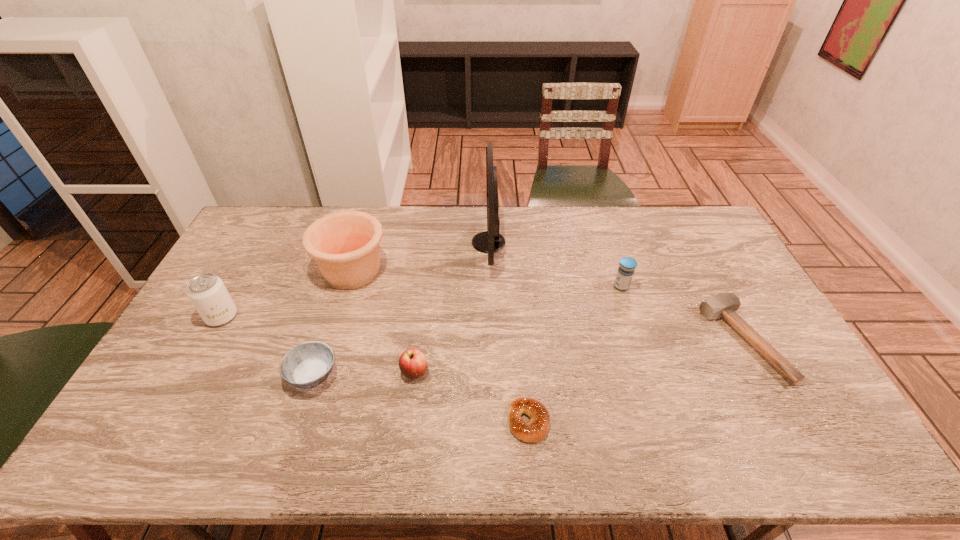
The image size is (960, 540). I want to click on unoccupied position between the soda can and the pottery, so click(287, 294).

You are a GUI agent. You are given a task and a screenshot of the screen. Output one action in this format:
    pyautogui.click(x=<x>, y=<y>)
    Task: Click on the empty space that is in between the third shortest object and the pottery
    The height and width of the screenshot is (540, 960).
    Given the screenshot: What is the action you would take?
    pyautogui.click(x=333, y=323)

Where is `vacant area that lies between the pottery and the third shortest object`? This screenshot has width=960, height=540. vacant area that lies between the pottery and the third shortest object is located at coordinates pyautogui.click(x=333, y=323).

The width and height of the screenshot is (960, 540). I want to click on vacant area that lies between the bagel and the second shortest object, so click(x=636, y=381).

Locate an element on the screen. free spot between the pottery and the bagel is located at coordinates (441, 346).

The width and height of the screenshot is (960, 540). What are the coordinates of `vacant space that is in between the seventh tallest object and the pottery` in the screenshot? It's located at (547, 306).

At what (x,y) coordinates should I click in order to perform the action: click on free space between the fifth shortest object and the fourth object from left to right. Please return your answer as a coordinate pair (x, y). Image resolution: width=960 pixels, height=540 pixels. Looking at the image, I should click on (518, 329).

Where is `vacant point located between the fourth shortest object and the medicine`? The height and width of the screenshot is (540, 960). vacant point located between the fourth shortest object and the medicine is located at coordinates (518, 329).

You are a GUI agent. You are given a task and a screenshot of the screen. Output one action in this format:
    pyautogui.click(x=<x>, y=<y>)
    Task: Click on the object that is the nearest to the ashtray
    The height and width of the screenshot is (540, 960).
    Given the screenshot: What is the action you would take?
    pyautogui.click(x=412, y=363)

The height and width of the screenshot is (540, 960). I want to click on the second closest object to the rightmost object, so click(534, 431).